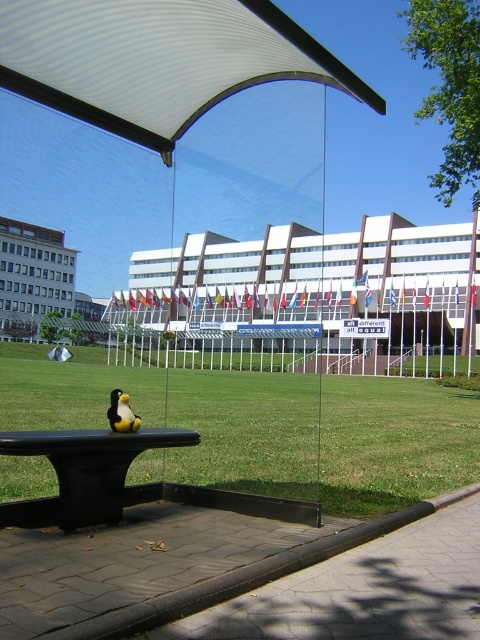
You are a visitor at the park and want to place a small toy on the black matte park bench at center so it can be seen from a distance. Would placing it on top of the yellow rubber duck at lower left make it more visible compared to placing it directly on the bench?

The black matte park bench at center is taller than the yellow rubber duck at lower left. Placing the toy on the bench would make it higher and more visible from a distance compared to placing it on the duck.

You are a visitor standing in front of the modern building. You see the black matte park bench at center and the yellow rubber duck at lower left. Which object is closer to the building?

The black matte park bench at center is closer to the building because it is located below the yellow rubber duck at lower left, meaning it is positioned lower in the image and therefore nearer to the building.

You are standing in front of the modern building and want to place a small penguin statue on the black bench. The bench has limited space. Which object, the white fabric canopy at upper center or the yellow rubber duck at lower left, is closer to the bench to help you decide where to place the penguin?

The yellow rubber duck at lower left is closer to the bench than the white fabric canopy at upper center, so placing the penguin near the yellow rubber duck at lower left would be more appropriate.